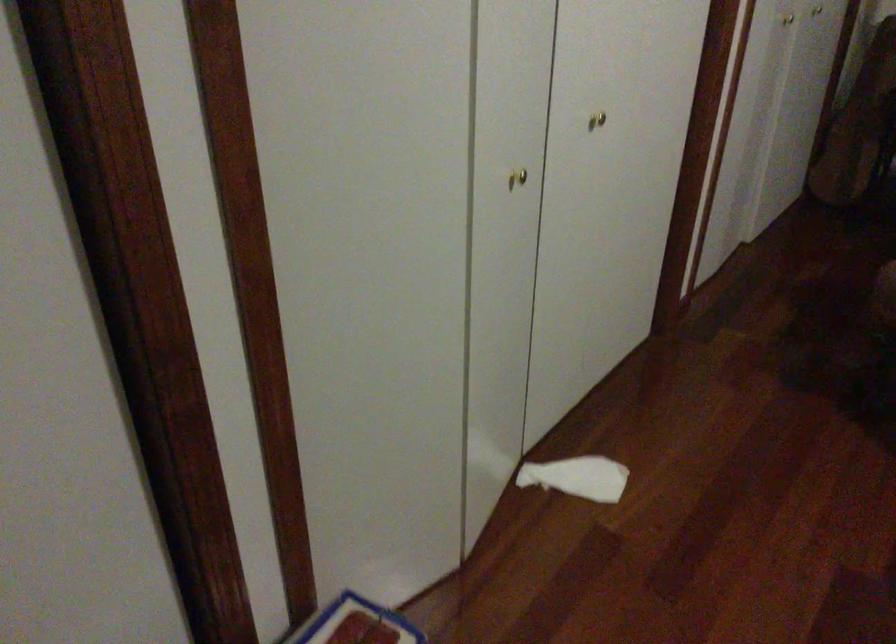
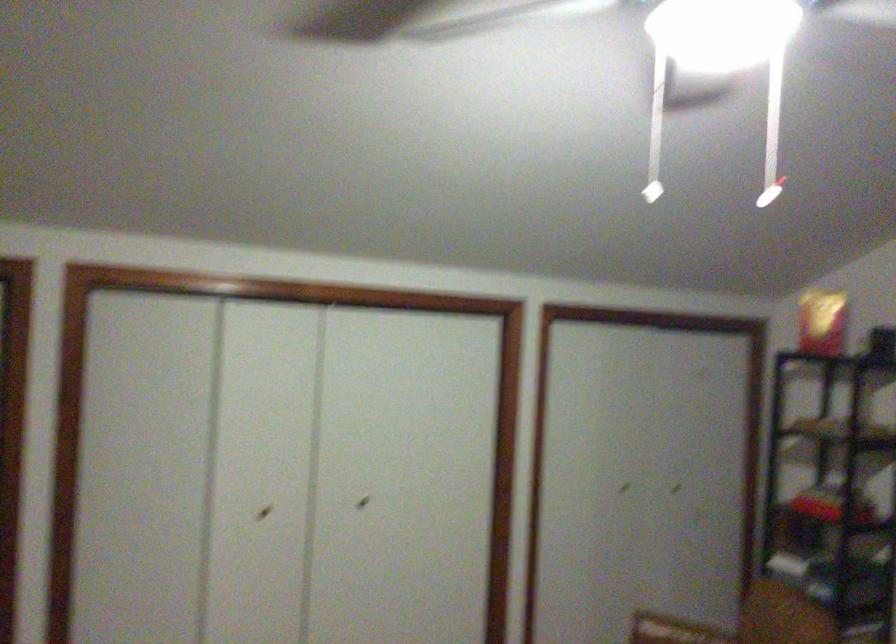
The point at (595, 107) is marked in the first image. Where is the corresponding point in the second image?

(363, 502)